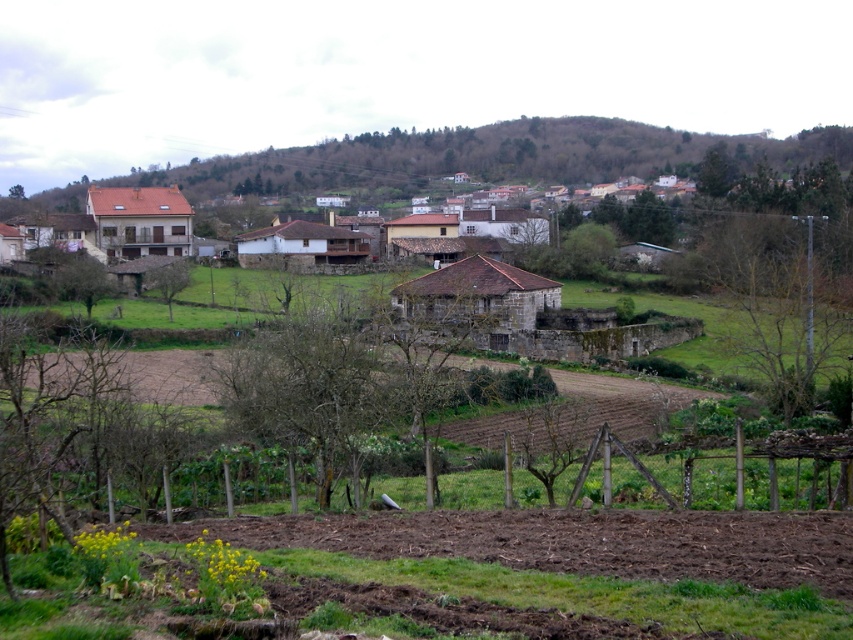
Can you confirm if green leafy tree at center-left is shorter than green leafy tree at upper right?

Yes.

The image size is (853, 640). Describe the element at coordinates (82, 282) in the screenshot. I see `green leafy tree at center-left` at that location.

Is point (85, 310) less distant than point (724, 182)?

Yes.

You are a GUI agent. You are given a task and a screenshot of the screen. Output one action in this format:
    pyautogui.click(x=<x>, y=<y>)
    Task: Click on the green leafy tree at center-left
    This screenshot has height=640, width=853.
    Given the screenshot: What is the action you would take?
    pyautogui.click(x=82, y=282)

Between brown stone house at center and green leafy tree at center-left, which one is positioned lower?

brown stone house at center is lower down.

What do you see at coordinates (438, 339) in the screenshot? The height and width of the screenshot is (640, 853). I see `brown stone house at center` at bounding box center [438, 339].

Where is `brown stone house at center`? brown stone house at center is located at coordinates (438, 339).

Is green leafy tree at center-left wider than green leafy tree at center?

Correct, the width of green leafy tree at center-left exceeds that of green leafy tree at center.

Who is shorter, green leafy tree at center-left or green leafy tree at center?

With less height is green leafy tree at center.

Is point (57, 282) positioned in front of point (170, 285)?

Yes.

The height and width of the screenshot is (640, 853). I want to click on green leafy tree at center-left, so click(82, 282).